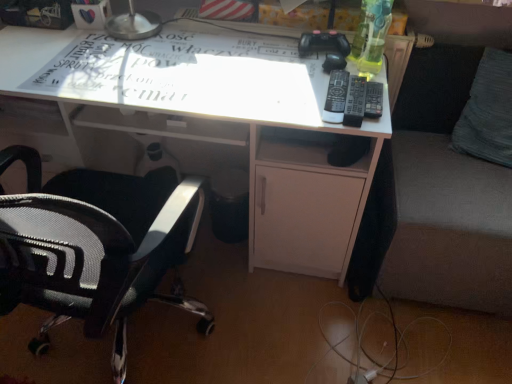
What do you see at coordinates (95, 247) in the screenshot? Image resolution: width=512 pixels, height=384 pixels. I see `black mesh office chair at left` at bounding box center [95, 247].

Measure the distance between point (375, 83) and camera.

The depth of point (375, 83) is 3.87 feet.

Locate an element on the screen. The image size is (512, 384). dark gray fabric couch at right is located at coordinates (446, 195).

The image size is (512, 384). Describe the element at coordinates (222, 122) in the screenshot. I see `white glossy desk at center` at that location.

What do you see at coordinates (355, 101) in the screenshot? I see `black plastic remote at right, the 2th remote viewed from the left` at bounding box center [355, 101].

Locate an element on the screen. white paper at center is located at coordinates (177, 76).

Is black plastic remote at right, the second remote when ordered from right to left, far away from dark gray fabric couch at right?

black plastic remote at right, the second remote when ordered from right to left, is near dark gray fabric couch at right, not far away.

Is black plastic remote at right, the second remote when ordered from right to left, facing towards dark gray fabric couch at right?

No, black plastic remote at right, the second remote when ordered from right to left, is not facing towards dark gray fabric couch at right.

Which is further, (346, 114) or (466, 220)?

The point (466, 220) is farther from the camera.

How far apart are black plastic remote at right, the second remote when ordered from right to left, and dark gray fabric couch at right?

black plastic remote at right, the second remote when ordered from right to left, and dark gray fabric couch at right are 20.60 inches apart from each other.

From the image's perspective, is black plastic remote at right, placed as the 1th remote when sorted from right to left, positioned above or below dark gray fabric couch at right?

black plastic remote at right, placed as the 1th remote when sorted from right to left, is situated higher than dark gray fabric couch at right in the image.

Is point (376, 117) farther from camera compared to point (457, 153)?

No, (376, 117) is closer to viewer.

Is black plastic remote at right, placed as the 1th remote when sorted from right to left, turned away from dark gray fabric couch at right?

No.

What's the angular difference between black plastic remote at right, placed as the 1th remote when sorted from right to left, and dark gray fabric couch at right's facing directions?

black plastic remote at right, placed as the 1th remote when sorted from right to left, and dark gray fabric couch at right are facing 3.91 degrees away from each other.

Is white glossy desk at center further to the viewer compared to black plastic remote at right, the second remote when ordered from right to left?

Yes, white glossy desk at center is further from the viewer.

Does point (352, 220) appear closer or farther from the camera than point (347, 109)?

Point (352, 220) is farther from the camera than point (347, 109).

Would you consider white glossy desk at center to be distant from black plastic remote at right, the 2th remote viewed from the left?

No, white glossy desk at center is in close proximity to black plastic remote at right, the 2th remote viewed from the left.

From a real-world perspective, is white glossy desk at center below black plastic remote at right, the 2th remote viewed from the left?

Yes, from a real-world perspective, white glossy desk at center is beneath black plastic remote at right, the 2th remote viewed from the left.

Considering the positions of objects white paper at center and white matte wire at lower center in the image provided, who is more to the right, white paper at center or white matte wire at lower center?

Positioned to the right is white matte wire at lower center.

How different are the orientations of white paper at center and white matte wire at lower center in degrees?

The angular difference between white paper at center and white matte wire at lower center is 49.6 degrees.

Which is closer, [81,65] or [358,310]?

The point [81,65] is in front.

Between white paper at center and white matte wire at lower center, which one is positioned in front?

Positioned in front is white paper at center.

Considering the sizes of objects black plastic remote at right, placed as the 1th remote when sorted from right to left, and black plastic remote at right, the second remote when ordered from right to left, in the image provided, who is shorter, black plastic remote at right, placed as the 1th remote when sorted from right to left, or black plastic remote at right, the second remote when ordered from right to left,?

Standing shorter between the two is black plastic remote at right, placed as the 1th remote when sorted from right to left.

Is black plastic remote at right, the 3th remote when ordered from left to right, touching black plastic remote at right, the 2th remote viewed from the left?

Yes, the surface of black plastic remote at right, the 3th remote when ordered from left to right, is in contact with black plastic remote at right, the 2th remote viewed from the left.

Is black plastic remote at right, the 2th remote viewed from the left, located within black plastic remote at right, placed as the 1th remote when sorted from right to left?

No, black plastic remote at right, placed as the 1th remote when sorted from right to left, does not contain black plastic remote at right, the 2th remote viewed from the left.

Considering the relative positions of dark gray fabric couch at right and black plastic remote at right, the second remote when ordered from right to left, in the image provided, is dark gray fabric couch at right to the right of black plastic remote at right, the second remote when ordered from right to left, from the viewer's perspective?

Correct, you'll find dark gray fabric couch at right to the right of black plastic remote at right, the second remote when ordered from right to left.

Is point (456, 240) closer to camera compared to point (345, 117)?

No, it is behind (345, 117).

Considering the sizes of dark gray fabric couch at right and black plastic remote at right, the 2th remote viewed from the left, in the image, is dark gray fabric couch at right taller or shorter than black plastic remote at right, the 2th remote viewed from the left,?

dark gray fabric couch at right is taller than black plastic remote at right, the 2th remote viewed from the left.

Is dark gray fabric couch at right looking in the opposite direction of black plastic remote at right, the 2th remote viewed from the left?

dark gray fabric couch at right is not turned away from black plastic remote at right, the 2th remote viewed from the left.

From the image's perspective, who appears lower, black plastic remote at right, the 3th remote when ordered from left to right, or white glossy desk at center?

white glossy desk at center.

Is black plastic remote at right, placed as the 1th remote when sorted from right to left, further to the viewer compared to white glossy desk at center?

Yes, the depth of black plastic remote at right, placed as the 1th remote when sorted from right to left, is greater than that of white glossy desk at center.

Between black plastic remote at right, placed as the 1th remote when sorted from right to left, and white glossy desk at center, which one has more height?

white glossy desk at center.

Are black plastic remote at right, the 3th remote when ordered from left to right, and white glossy desk at center beside each other?

No, black plastic remote at right, the 3th remote when ordered from left to right, is not next to white glossy desk at center.

The image size is (512, 384). Find the location of `the 1st remote above the dark gray fabric couch at right (from the image's perspective)`. the 1st remote above the dark gray fabric couch at right (from the image's perspective) is located at coordinates (355, 101).

Locate an element on the screen. couch on the right of black plastic remote at right, the 3th remote when ordered from left to right is located at coordinates (446, 195).

When comparing their distances from white paper at center, does black plastic remote at upper right, which ranks as the 1th remote in left-to-right order, or black plastic remote at right, the 3th remote when ordered from left to right, seem closer?

The object closer to white paper at center is black plastic remote at upper right, which ranks as the 1th remote in left-to-right order.

Considering their positions, is black mesh office chair at left positioned further to black plastic remote at right, the 2th remote viewed from the left, than dark gray fabric couch at right?

black mesh office chair at left.

Considering their positions, is white matte wire at lower center positioned closer to black plastic remote at right, the 2th remote viewed from the left, than black plastic remote at upper right, which ranks as the 1th remote in left-to-right order?

black plastic remote at upper right, which ranks as the 1th remote in left-to-right order, is closer to black plastic remote at right, the 2th remote viewed from the left.

Considering their positions, is black mesh office chair at left positioned closer to dark gray fabric couch at right than white paper at center?

white paper at center.

When comparing their distances from black plastic remote at upper right, which ranks as the 1th remote in left-to-right order, does white glossy desk at center or dark gray fabric couch at right seem closer?

The object closer to black plastic remote at upper right, which ranks as the 1th remote in left-to-right order, is white glossy desk at center.

Considering their positions, is black plastic remote at right, the 2th remote viewed from the left, positioned further to white matte wire at lower center than black plastic remote at right, the 3th remote when ordered from left to right?

black plastic remote at right, the 2th remote viewed from the left, is further to white matte wire at lower center.

Estimate the real-world distances between objects in this image. Which object is further from white matte wire at lower center, black plastic remote at right, the 3th remote when ordered from left to right, or white paper at center?

white paper at center lies further to white matte wire at lower center than the other object.

Based on their spatial positions, is white paper at center or white glossy desk at center further from black plastic remote at right, the second remote when ordered from right to left?

white glossy desk at center lies further to black plastic remote at right, the second remote when ordered from right to left, than the other object.

At what (x,y) coordinates should I click in order to perform the action: click on remote situated between black plastic remote at right, the 2th remote viewed from the left, and dark gray fabric couch at right from left to right. Please return your answer as a coordinate pair (x, y). This screenshot has width=512, height=384. Looking at the image, I should click on (373, 100).

The image size is (512, 384). I want to click on desk between black plastic remote at upper right, which ranks as the 1th remote in left-to-right order, and white matte wire at lower center in the up-down direction, so click(222, 122).

You are a GUI agent. You are given a task and a screenshot of the screen. Output one action in this format:
    pyautogui.click(x=<x>, y=<y>)
    Task: Click on the desk between black mesh office chair at left and white matte wire at lower center in the horizontal direction
    Image resolution: width=512 pixels, height=384 pixels.
    Given the screenshot: What is the action you would take?
    222,122

The height and width of the screenshot is (384, 512). I want to click on couch between black plastic remote at upper right, the third remote from the right, and white matte wire at lower center vertically, so click(446, 195).